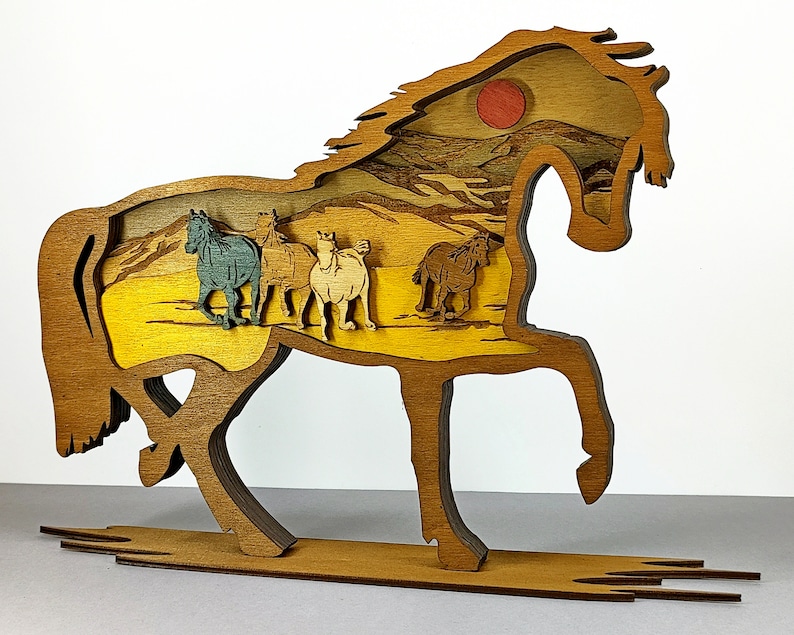
Locate an element on the screen. The image size is (794, 635). back wall is located at coordinates (162, 53), (719, 399), (33, 416), (738, 63).